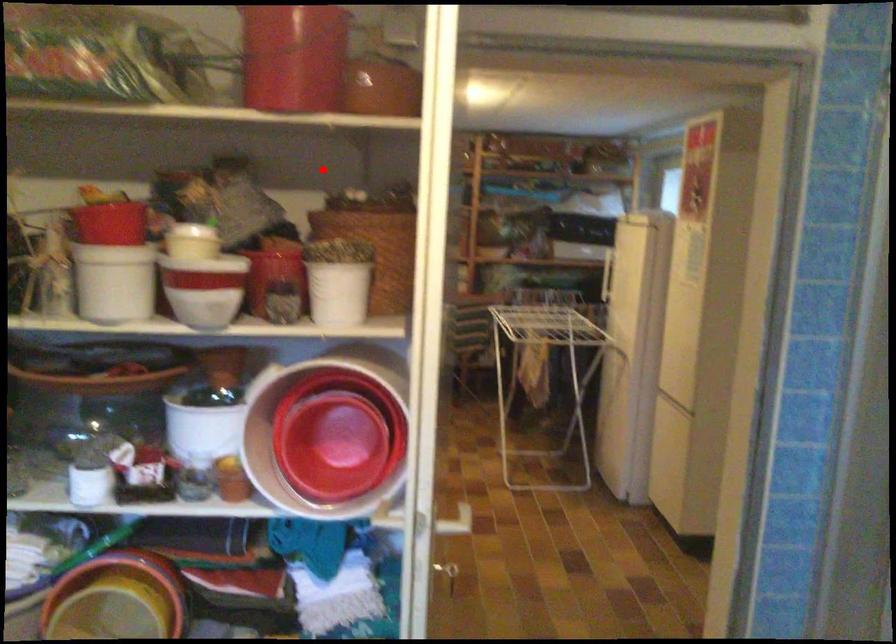
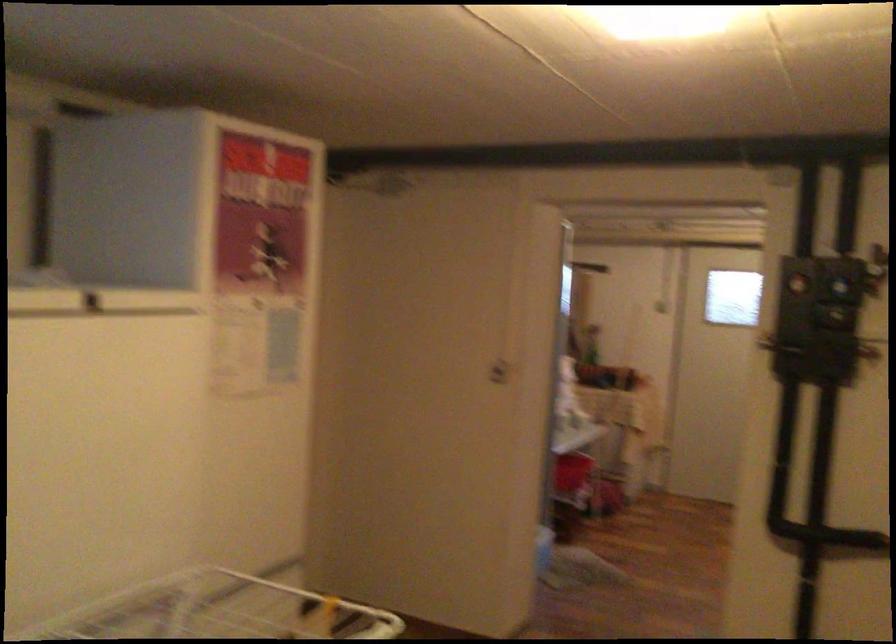
In the second image, find the point that corresponds to the highlighted location in the first image.

(840, 281)